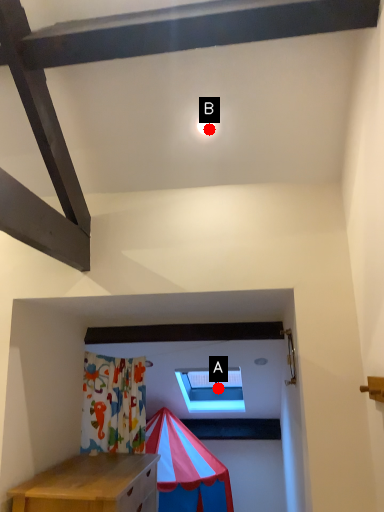
Question: Two points are circled on the image, labeled by A and B beside each circle. Which point is closer to the camera?

Choices:
 (A) A is closer
 (B) B is closer

Answer: (B)